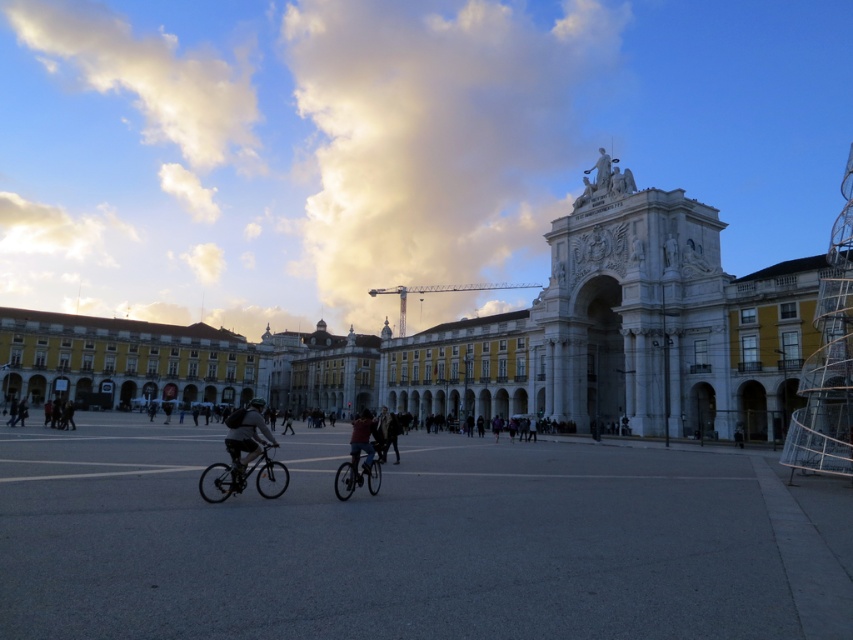
You are a pedestrian standing at the edge of the square and want to cross to the other side. There is a shiny metallic bicycle at lower left and a dark gray jacket at center. Which object should you avoid stepping near to ensure safety?

You should avoid stepping near the shiny metallic bicycle at lower left because it is positioned to the right of the dark gray jacket at center, indicating it might be in the path of moving cyclists.

You are a delivery person who needs to park your shiny metallic bicycle at lower left near the dark gray jacket at center. Can you fit both the bicycle and the jacket in the available space without overlapping?

The shiny metallic bicycle at lower left occupies less space than the dark gray jacket at center. Therefore, the bicycle can be parked near the jacket, but there might not be enough space for both without overlapping since the jacket takes up more area.